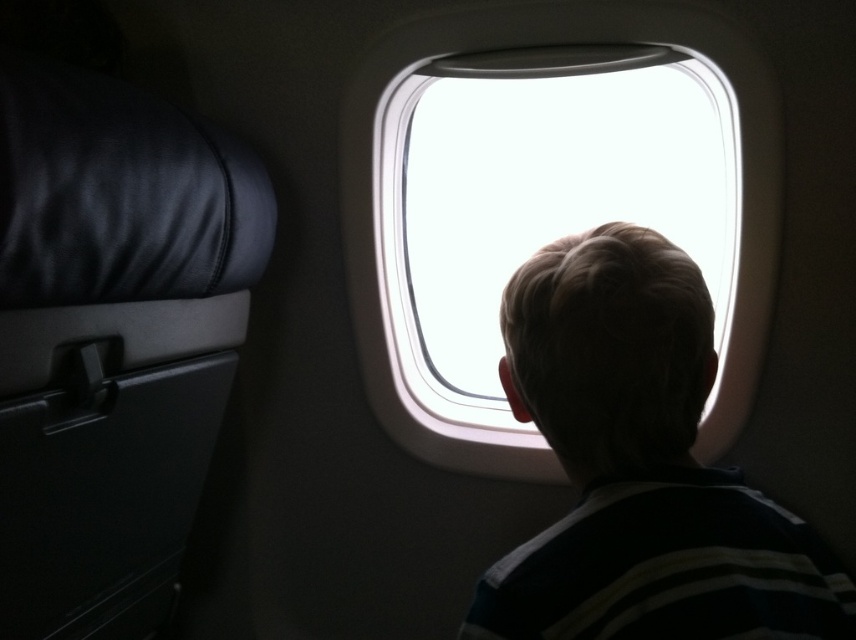
You are a flight attendant checking the cabin. You notice the blonde hair at window right and the transparent glass airplane window at center. Which object takes up more space in the image?

The blonde hair at window right is larger in size than the transparent glass airplane window at center, so it takes up more space in the image.

You are a flight attendant checking the airplane window for damage. You notice the blonde hair at window right and the transparent glass airplane window at center. Which object has a smaller width?

The blonde hair at window right is thinner than the transparent glass airplane window at center, so the blonde hair at window right has a smaller width.

You are standing in an airplane cabin and want to reach a point marked at coordinates (515, 396). If your arm length is 29.99 inches, can you reach that point without moving your feet?

The point at (515, 396) is exactly 29.99 inches away from you, so yes, you can reach it with your arm length of 29.99 inches without moving your feet.